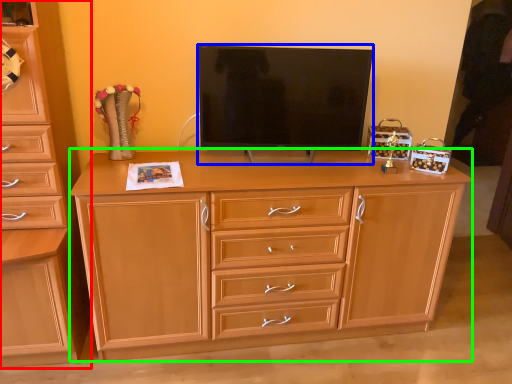
Question: Which object is positioned farthest from chest of drawers (highlighted by a red box)? Select from television (highlighted by a blue box) and chest of drawers (highlighted by a green box).

Choices:
 (A) television
 (B) chest of drawers

Answer: (A)